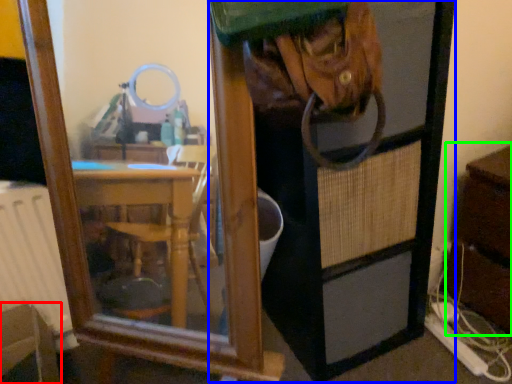
Question: Which object is positioned farthest from furniture (highlighted by a red box)? Select from screen door (highlighted by a blue box) and dresser (highlighted by a green box).

Choices:
 (A) screen door
 (B) dresser

Answer: (B)